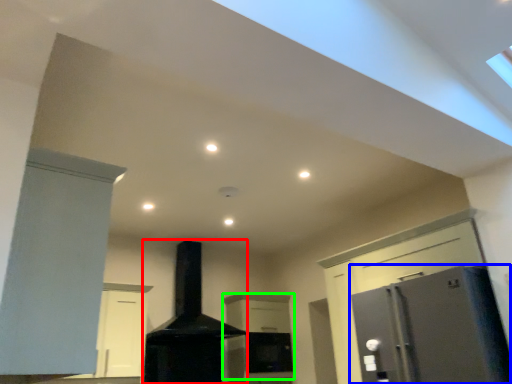
Question: Which is farther away from fireplace (highlighted by a red box)? refrigerator (highlighted by a blue box) or cabinetry (highlighted by a green box)?

Choices:
 (A) refrigerator
 (B) cabinetry

Answer: (A)